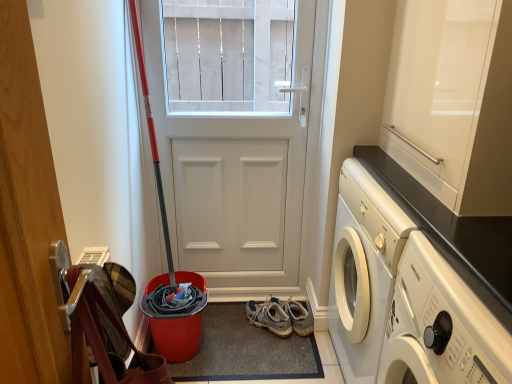
Question: Is white glossy washing machine at lower right inside or outside of glossy white cabinet at upper right?

Choices:
 (A) outside
 (B) inside

Answer: (A)

Question: In the image, is white glossy washing machine at lower right positioned in front of or behind glossy white cabinet at upper right?

Choices:
 (A) behind
 (B) front

Answer: (B)

Question: Which of these objects is positioned farthest from the gray suede sneakers at lower center?

Choices:
 (A) white matte door at center
 (B) black granite countertop at upper right
 (C) white glossy washing machine at lower right
 (D) glossy white cabinet at upper right

Answer: (D)

Question: Considering the real-world distances, which object is closest to the gray suede sneakers at lower center?

Choices:
 (A) white matte door at center
 (B) white glossy washing machine at lower right
 (C) glossy white cabinet at upper right
 (D) black granite countertop at upper right

Answer: (A)